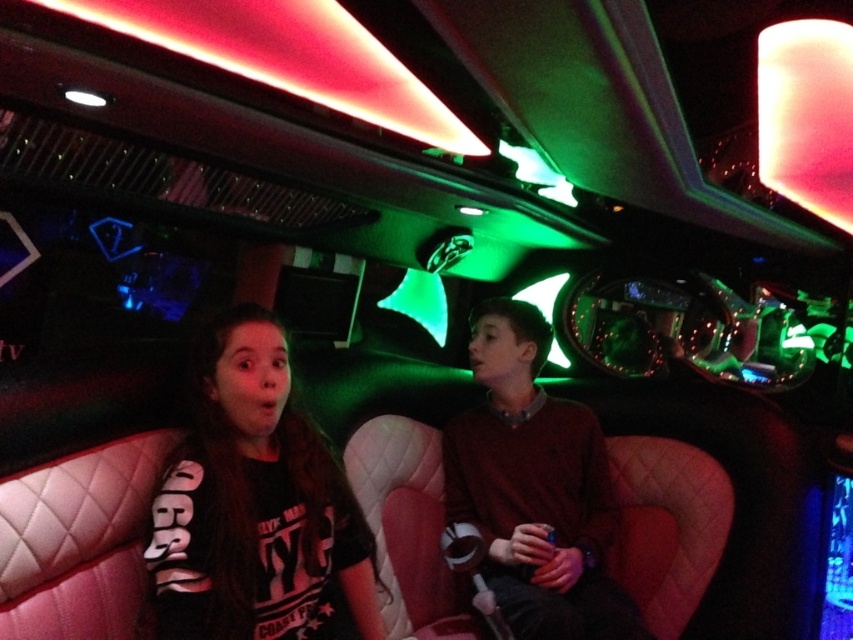
Who is positioned more to the right, black cotton shirt at center or matte brown sweater at center?

From the viewer's perspective, matte brown sweater at center appears more on the right side.

This screenshot has width=853, height=640. What do you see at coordinates (254, 502) in the screenshot? I see `black cotton shirt at center` at bounding box center [254, 502].

Locate an element on the screen. Image resolution: width=853 pixels, height=640 pixels. black cotton shirt at center is located at coordinates (254, 502).